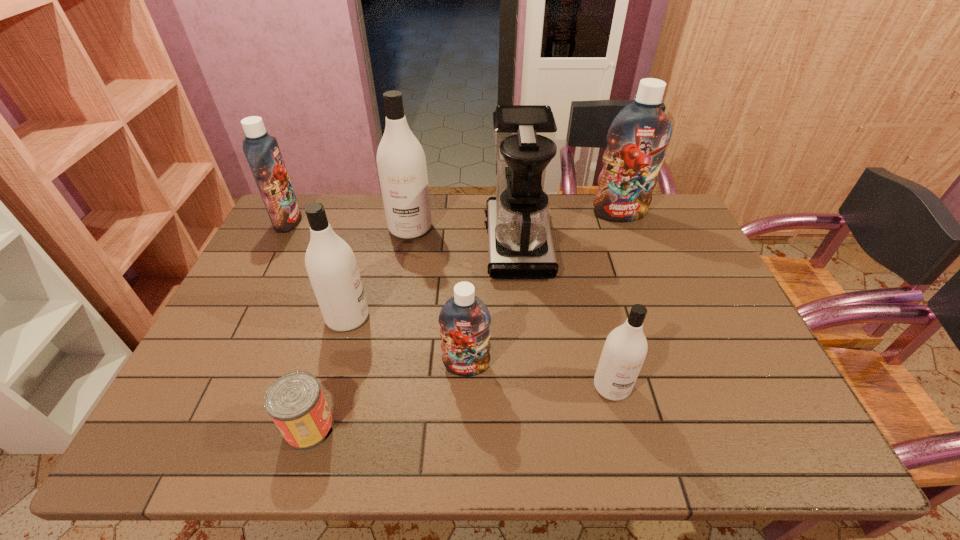
Locate an element on the screen. Image resolution: width=960 pixels, height=540 pixels. the seventh object from left to right is located at coordinates (625, 349).

Where is `the nearest white shampoo`? The height and width of the screenshot is (540, 960). the nearest white shampoo is located at coordinates (625, 349).

Find the location of `the nearest object`. the nearest object is located at coordinates (x=295, y=402).

Locate an element on the screen. The width and height of the screenshot is (960, 540). the shortest object is located at coordinates (295, 402).

You are a GUI agent. You are given a task and a screenshot of the screen. Output one action in this format:
    pyautogui.click(x=<x>, y=<y>)
    Task: Click on the free point located on the front-facing side of the farthest white shampoo
    This screenshot has width=960, height=540.
    Given the screenshot: What is the action you would take?
    pyautogui.click(x=394, y=320)

Image resolution: width=960 pixels, height=540 pixels. Find the location of `vacant region located 0.190m on the front label of the rightmost shampoo`. vacant region located 0.190m on the front label of the rightmost shampoo is located at coordinates (636, 260).

This screenshot has height=540, width=960. In order to click on vacant space located at the front of the gray coffee maker where the controls are located in this screenshot , I will do `click(444, 242)`.

Identify the location of vacant space located 0.370m at the front of the gray coffee maker where the controls are located. (370, 242).

You are a GUI agent. You are given a task and a screenshot of the screen. Output one action in this format:
    pyautogui.click(x=<x>, y=<y>)
    Task: Click on the vacant space situated at the front of the gray coffee maker where the controls are located
    
    Given the screenshot: What is the action you would take?
    pyautogui.click(x=417, y=242)

This screenshot has height=540, width=960. I want to click on vacant space located on the front label of the leftmost shampoo, so click(418, 221).